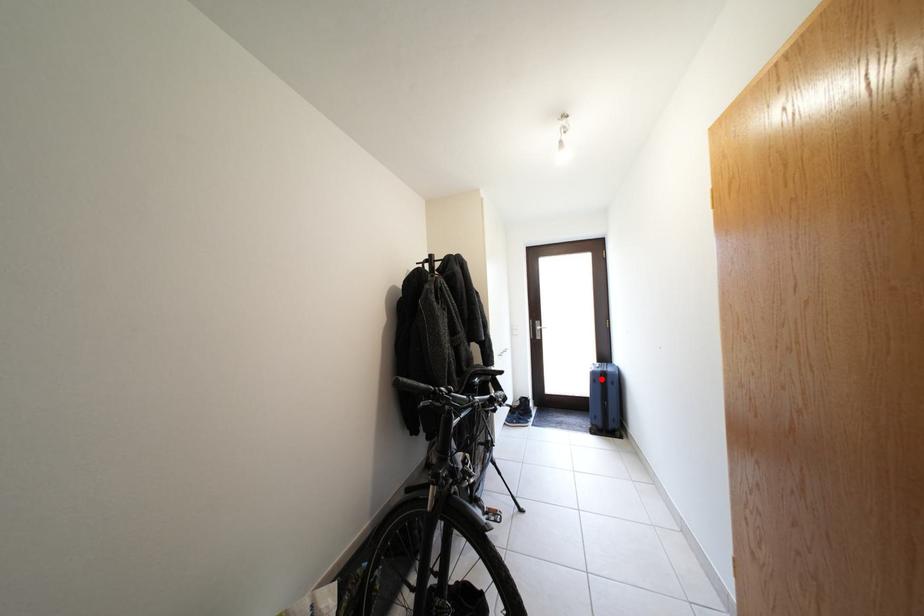
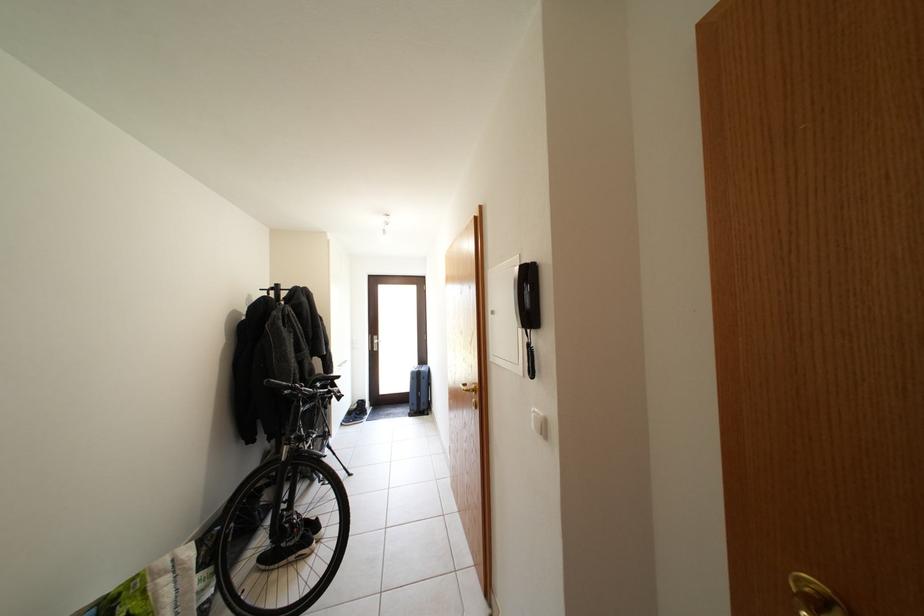
Question: I am providing you with two images of the same scene from different viewpoints. Image1 has a red point marked. In image2, the corresponding 3D location appears at what relative position? Reply with the corresponding letter.

Choices:
 (A) Closer
 (B) Farther

Answer: (B)